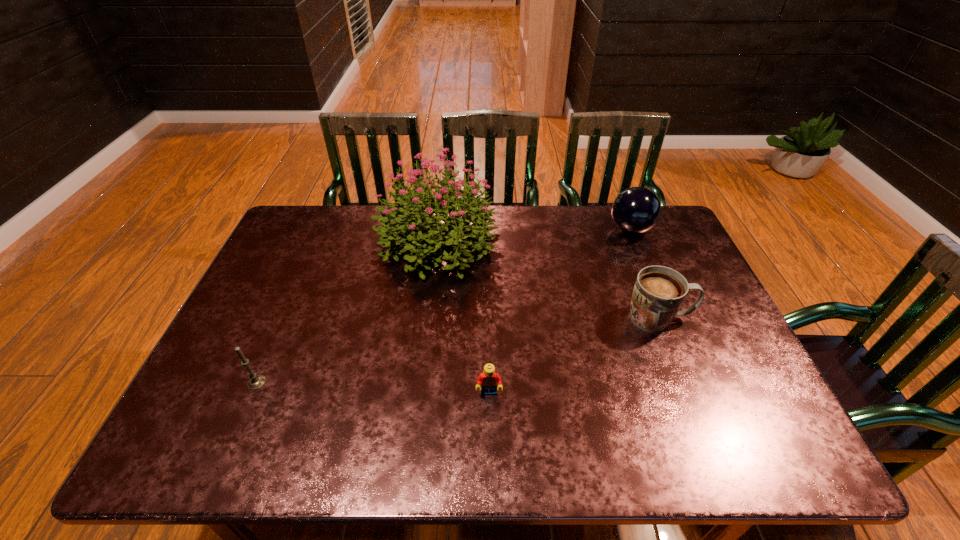
Find the location of a particular element. vacant area located 0.110m on the face of the shortest object is located at coordinates (490, 445).

Where is `bouquet at the far edge`? The width and height of the screenshot is (960, 540). bouquet at the far edge is located at coordinates (422, 207).

At what (x,y) coordinates should I click in order to perform the action: click on bowling ball located at the far edge. Please return your answer as a coordinate pair (x, y). The image size is (960, 540). Looking at the image, I should click on (636, 210).

Locate an element on the screen. The height and width of the screenshot is (540, 960). object at the left edge is located at coordinates (257, 381).

The width and height of the screenshot is (960, 540). What are the coordinates of `bowling ball that is at the right edge` in the screenshot? It's located at (636, 210).

Find the location of a particular element. mug at the right edge is located at coordinates (659, 292).

Find the location of `object positioned at the far right corner`. object positioned at the far right corner is located at coordinates (636, 210).

I want to click on vacant region at the far edge of the desktop, so click(x=543, y=221).

Find the location of `vacant space at the near edge`. vacant space at the near edge is located at coordinates (351, 434).

In the image, there is a desktop. At what (x,y) coordinates should I click in order to perform the action: click on vacant region at the left edge. Please return your answer as a coordinate pair (x, y). Image resolution: width=960 pixels, height=540 pixels. Looking at the image, I should click on (243, 396).